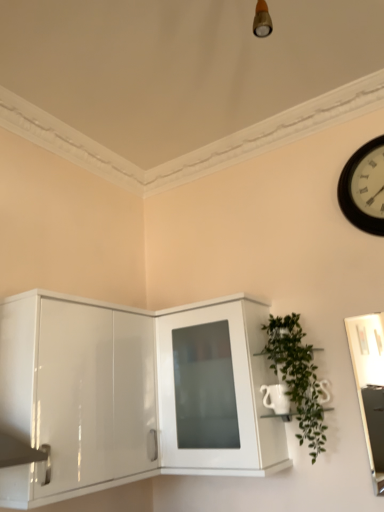
Question: Do you think glossy white cabinet at lower left, positioned as the second cabinetry in right-to-left order, is within green leafy plant at right, or outside of it?

Choices:
 (A) inside
 (B) outside

Answer: (B)

Question: In terms of width, does glossy white cabinet at lower left, positioned as the second cabinetry in right-to-left order, look wider or thinner when compared to green leafy plant at right?

Choices:
 (A) thin
 (B) wide

Answer: (B)

Question: Considering the real-world distances, which object is farthest from the green leafy plant at right?

Choices:
 (A) white glossy cabinet at center, which is the 1th cabinetry from right to left
 (B) glossy white cabinet at lower left, the 1th cabinetry in the left-to-right sequence
 (C) black wooden clock at upper right

Answer: (C)

Question: Which is nearer to the white glossy cabinet at center, which is the 1th cabinetry from right to left?

Choices:
 (A) black wooden clock at upper right
 (B) green leafy plant at right
 (C) glossy white cabinet at lower left, the 1th cabinetry in the left-to-right sequence

Answer: (C)